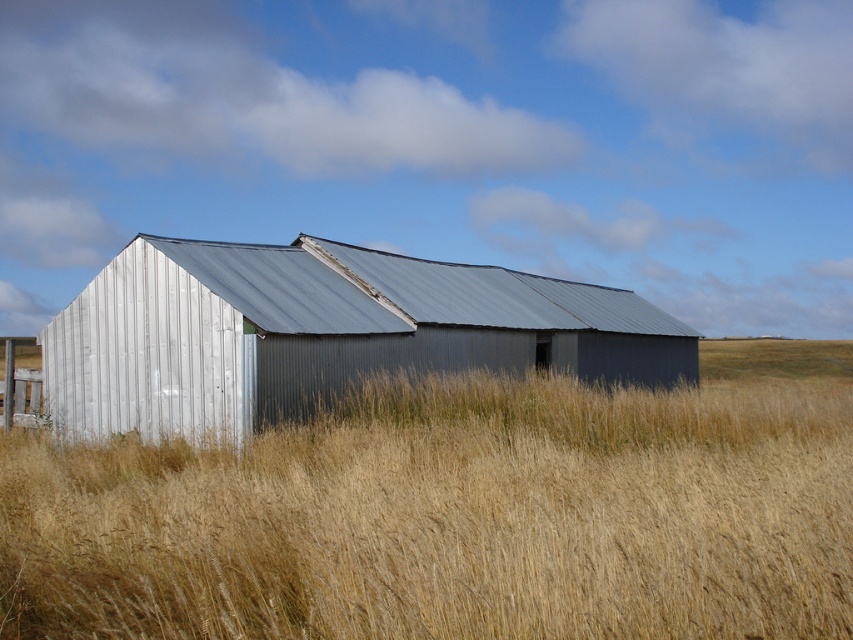
You are standing at the entrance of the weathered metal building and want to walk to the golden dry grass at center. What direction should you face to move directly toward it?

The golden dry grass at center is located at point 0.803 in the x coordinate and 0.539 in the y coordinate. Since you are at the entrance of the building, which is likely positioned at the front of the structure, facing the golden dry grass at center would require you to face towards the direction of the center point relative to your position. However, without specific spatial orientation details, the most accurate answer based on the provided coordinates is that the golden dry grass at center is positioned

You are a farmer standing in the field and want to mow the golden dry grass at center. However, your tractor can only operate safely around structures that are taller than the grass. Is the metallic silver barn at center a safe area to approach with the tractor?

The golden dry grass at center is not as tall as the metallic silver barn at center, so the barn is taller than the grass. Therefore, the tractor can safely approach the metallic silver barn at center since it is taller than the golden dry grass at center.